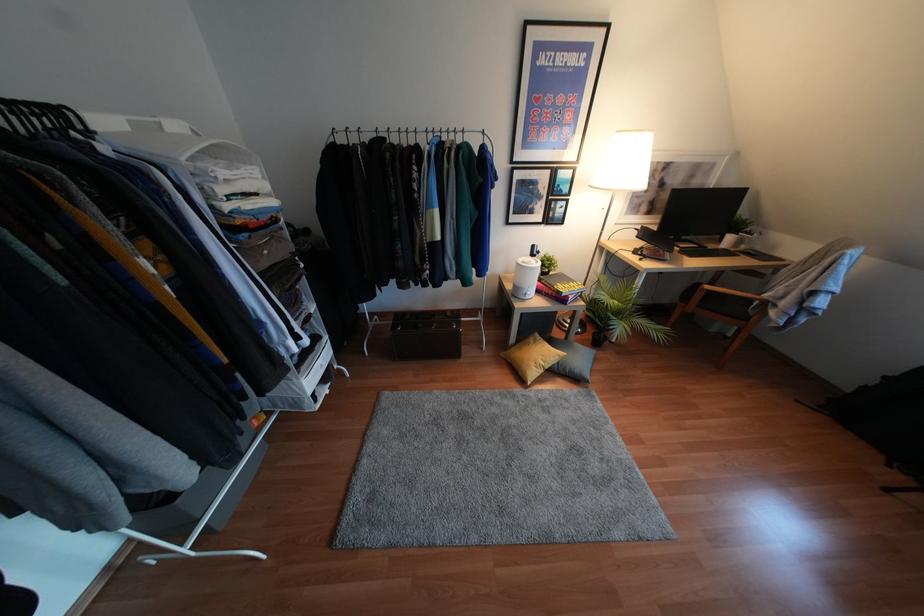
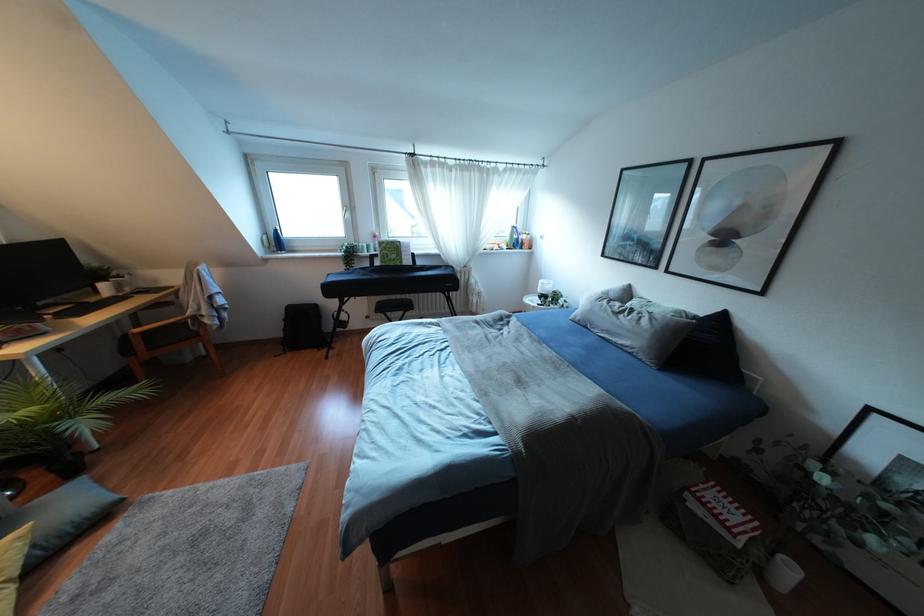
Where in the second image is the point corresponding to point 864,387 from the first image?

(284, 329)